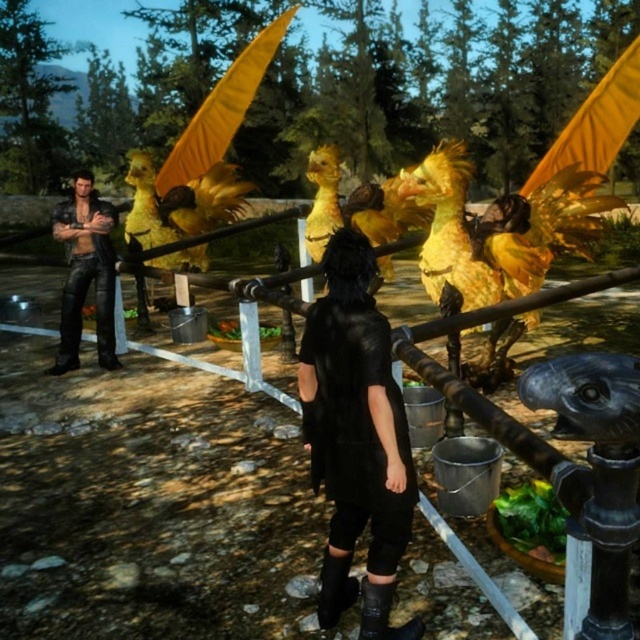
You are a game developer designing a level where two characters must navigate through a narrow path. The black matte dress at center and the leather jacket at left are positioned in the scene. Which character should you adjust to ensure they fit through the path without overlapping?

The black matte dress at center occupies less space than the leather jacket at left, so adjusting the leather jacket at left would be necessary to ensure it fits through the narrow path without overlapping.

You are navigating a video game environment and need to locate the black matte dress at center. According to the map coordinates provided, where should you look to find it?

The black matte dress at center is located at point coordinates of (356, 438).